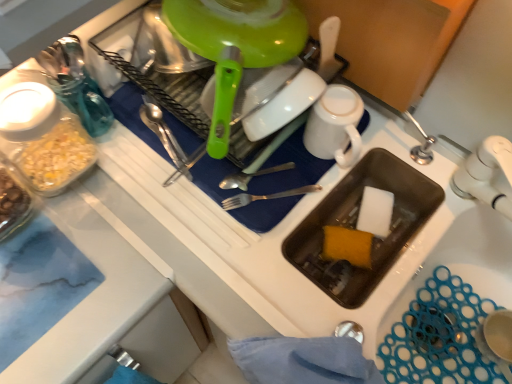
Identify the location of free location in front of shiny metal spoon at center. This screenshot has width=512, height=384. (173, 211).